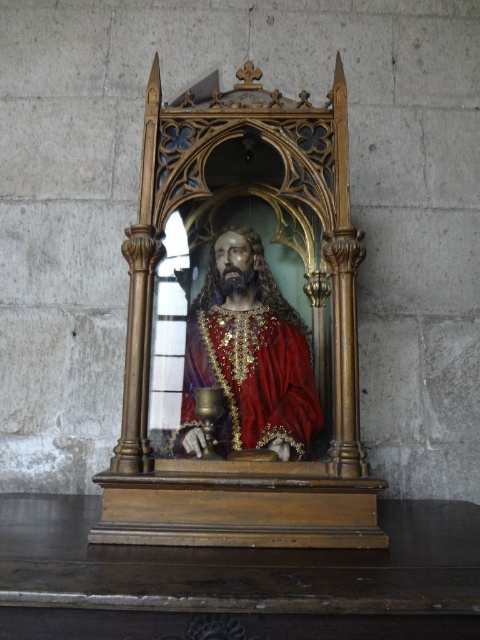
Question: Where is wooden statue at center located in relation to shiny gold statue at center in the image?

Choices:
 (A) below
 (B) above

Answer: (B)

Question: Does wooden statue at center appear on the left side of shiny gold statue at center?

Choices:
 (A) yes
 (B) no

Answer: (B)

Question: Does wooden statue at center appear on the right side of shiny gold statue at center?

Choices:
 (A) yes
 (B) no

Answer: (A)

Question: Among these objects, which one is nearest to the camera?

Choices:
 (A) shiny gold statue at center
 (B) wooden statue at center

Answer: (B)